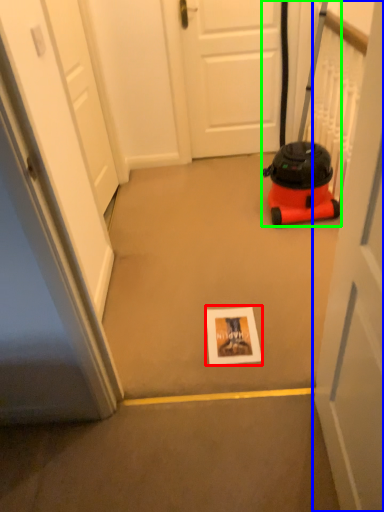
Question: Which is nearer to the postcard (highlighted by a red box)? door (highlighted by a blue box) or equipment (highlighted by a green box).

Choices:
 (A) door
 (B) equipment

Answer: (A)